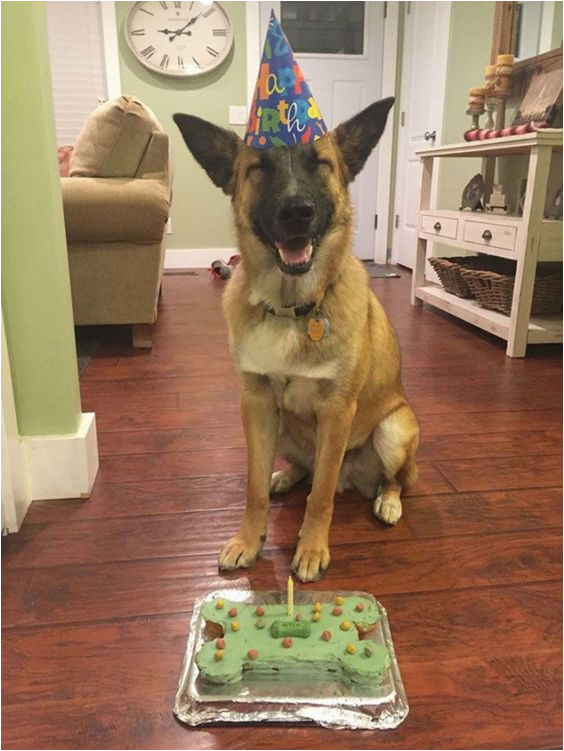
At what (x,y) coordinates should I click in order to perform the action: click on doors. Please return your answer as a coordinate pair (x, y). The width and height of the screenshot is (564, 751). Looking at the image, I should click on (429, 50), (352, 86).